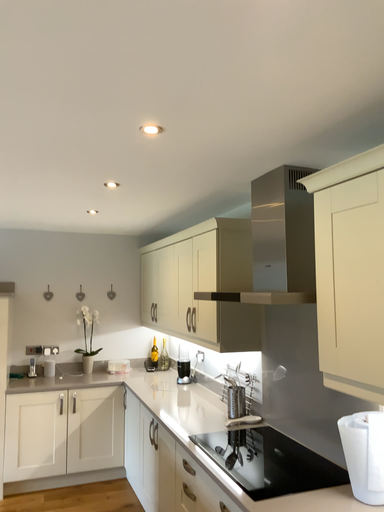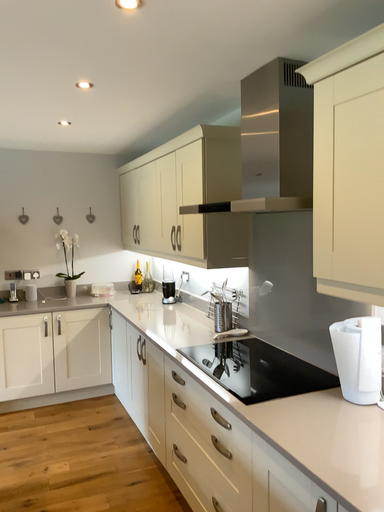
Question: Which way did the camera rotate in the video?

Choices:
 (A) rotated upward
 (B) rotated downward

Answer: (B)